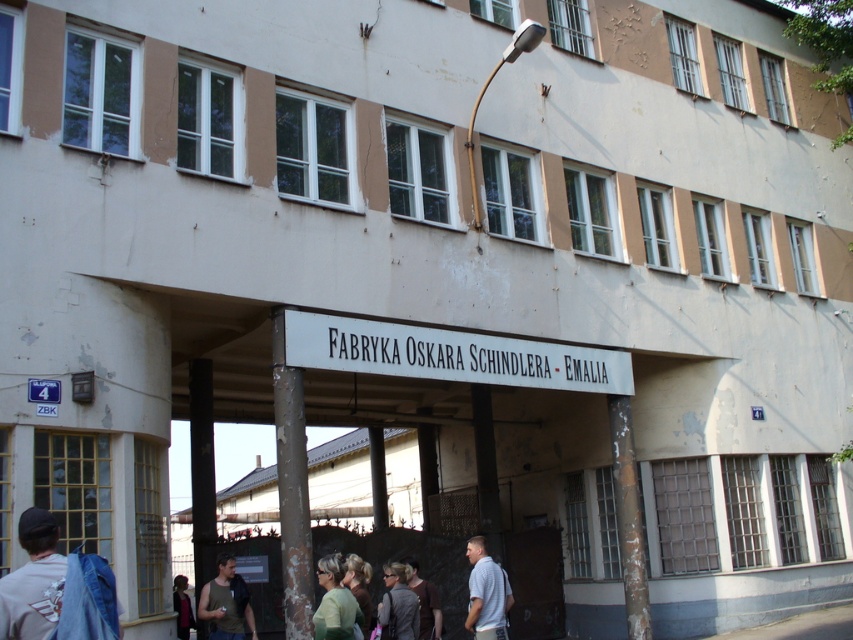
Question: Is the position of rusty metal pole at center less distant than that of brown matte door at center?

Choices:
 (A) yes
 (B) no

Answer: (A)

Question: Which point is farther to the camera?

Choices:
 (A) 624,492
 (B) 335,618
 (C) 474,570
 (D) 222,634

Answer: (A)

Question: Can you confirm if denim jacket at lower left is wider than light brown hair at center?

Choices:
 (A) no
 (B) yes

Answer: (B)

Question: Which object appears farthest from the camera in this image?

Choices:
 (A) light blue shirt at center
 (B) gray fabric jacket at lower center
 (C) light green fabric shirt at lower center
 (D) black matte pillar at lower left

Answer: (D)

Question: Which object appears farthest from the camera in this image?

Choices:
 (A) dark brown leather jacket at lower left
 (B) light green fabric shirt at lower center
 (C) rusty metal pole at center

Answer: (C)

Question: Is rusty metal pole at center bigger than light blue shirt at center?

Choices:
 (A) yes
 (B) no

Answer: (B)